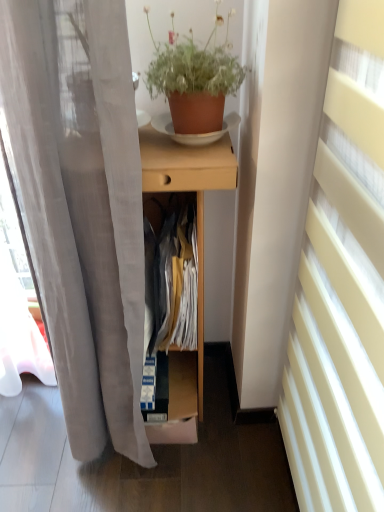
The image size is (384, 512). What are the coordinates of `empty space that is ontop of cardboard box at center (from a real-world perspective)` in the screenshot? It's located at (177, 379).